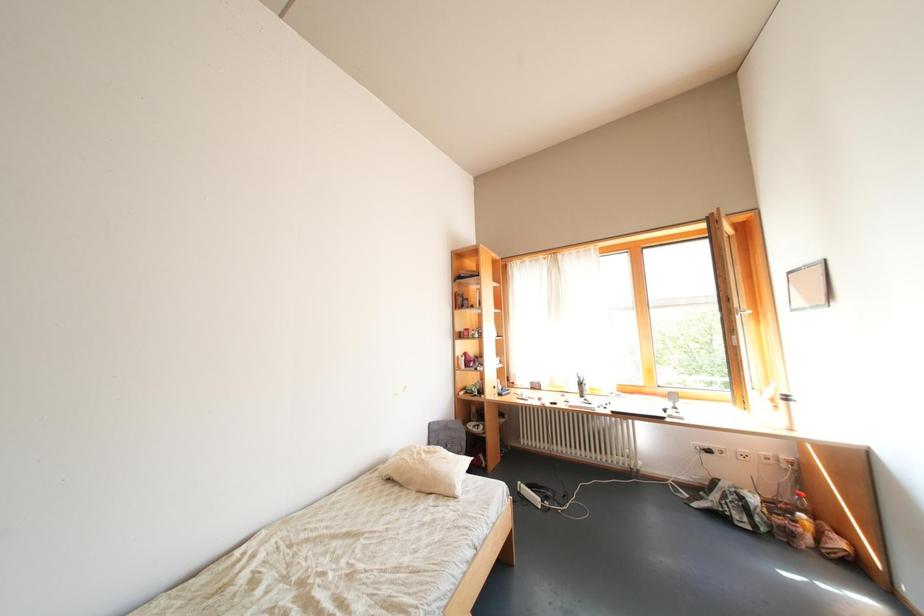
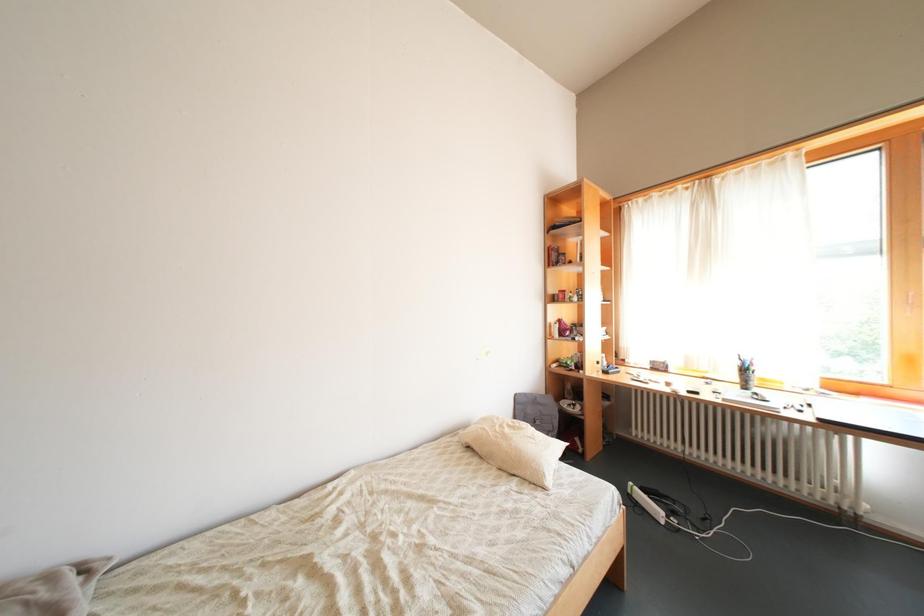
Question: The camera is either moving clockwise (left) or counter-clockwise (right) around the object. The first image is from the beginning of the video and the second image is from the end. Is the camera moving left or right when shooting the video?

Choices:
 (A) Left
 (B) Right

Answer: (B)